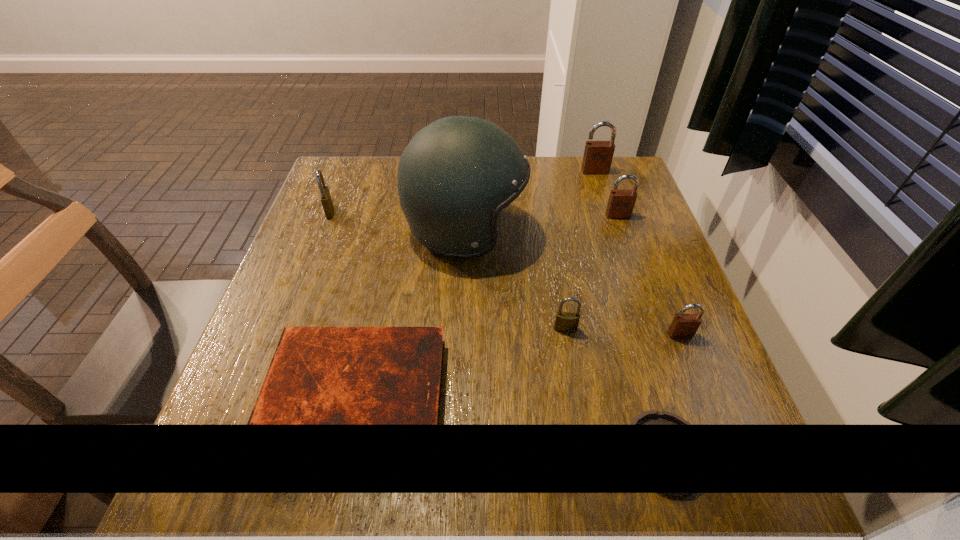
Locate an element on the screen. vacant area between the football helmet and the second tallest object is located at coordinates (530, 201).

This screenshot has height=540, width=960. In order to click on free area in between the second biggest brown padlock and the smaller brass padlock in this screenshot , I will do `click(591, 272)`.

Where is `blank region between the smaller brass padlock and the leftmost padlock`? blank region between the smaller brass padlock and the leftmost padlock is located at coordinates (447, 270).

Where is `vacant region between the farthest padlock and the seventh tallest object`? vacant region between the farthest padlock and the seventh tallest object is located at coordinates (476, 285).

I want to click on free space between the nearest brown padlock and the second smallest brown padlock, so click(649, 275).

Locate an element on the screen. the third closest object to the seventh shortest object is located at coordinates (565, 321).

The height and width of the screenshot is (540, 960). In order to click on object that ranks as the seventh closest to the second biggest brown padlock in this screenshot , I will do `click(325, 197)`.

Identify which padlock is the closest to the fourth object from left to right. Please provide its 2D coordinates. Your answer should be formatted as a tuple, i.e. [(x, y)], where the tuple contains the x and y coordinates of a point satisfying the conditions above.

[(684, 326)]

Select which padlock appears as the second closest to the green football helmet. Please provide its 2D coordinates. Your answer should be formatted as a tuple, i.e. [(x, y)], where the tuple contains the x and y coordinates of a point satisfying the conditions above.

[(325, 197)]

What are the coordinates of `brown padlock that is the closest one to the second shortest object` in the screenshot? It's located at (684, 326).